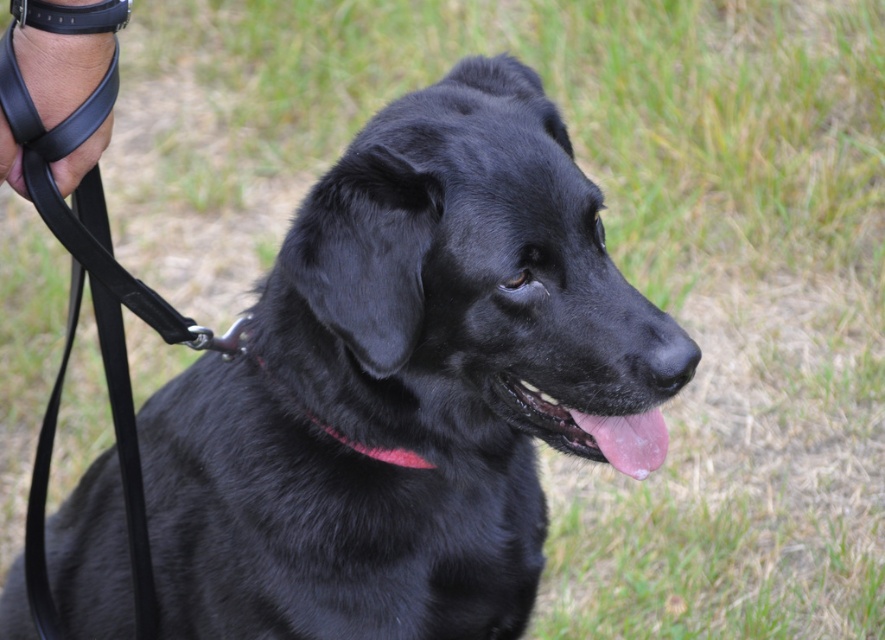
Question: Does pink glossy tongue at center have a lesser width compared to pink fabric neckband at center?

Choices:
 (A) yes
 (B) no

Answer: (A)

Question: Among these points, which one is farthest from the camera?

Choices:
 (A) (501, 484)
 (B) (326, 429)

Answer: (A)

Question: Which object is positioned closest to the pink glossy tongue at center?

Choices:
 (A) pink fabric neckband at center
 (B) black leather leash at upper left
 (C) black matte dog at center

Answer: (A)

Question: Based on their relative distances, which object is farther from the black leather leash at upper left?

Choices:
 (A) pink glossy tongue at center
 (B) black matte dog at center
 (C) pink fabric neckband at center

Answer: (A)

Question: Is black leather leash at upper left behind pink glossy tongue at center?

Choices:
 (A) no
 (B) yes

Answer: (A)

Question: Does black matte dog at center appear on the right side of black leather leash at upper left?

Choices:
 (A) yes
 (B) no

Answer: (A)